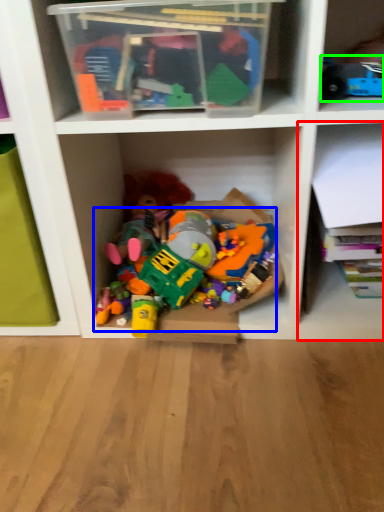
Question: Which object is the closest to the shelf (highlighted by a red box)? Choose among these: toy (highlighted by a blue box) or toy (highlighted by a green box).

Choices:
 (A) toy
 (B) toy

Answer: (A)